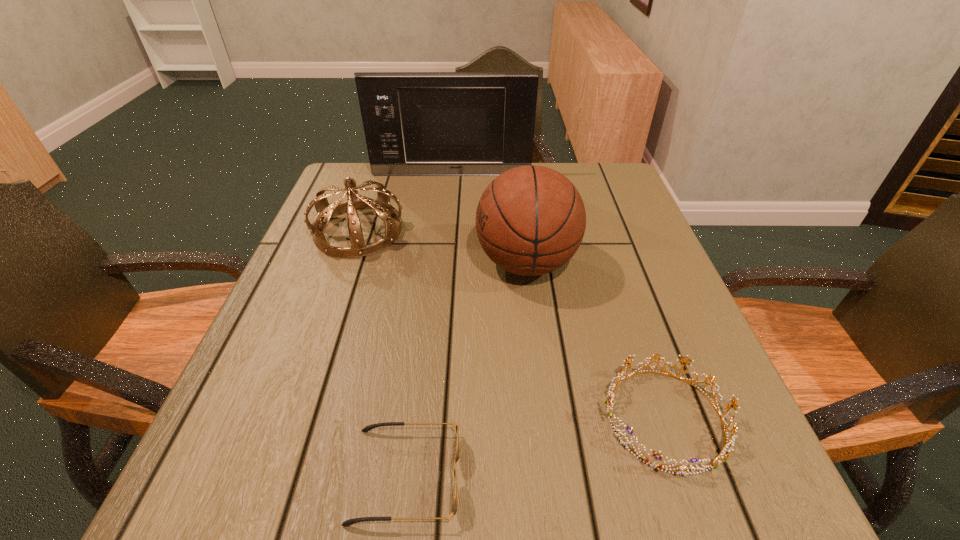
Where is `sunglasses located at the near edge`? The width and height of the screenshot is (960, 540). sunglasses located at the near edge is located at coordinates (349, 522).

Find the location of `microwave oven present at the left edge`. microwave oven present at the left edge is located at coordinates (416, 123).

Locate an element on the screen. The image size is (960, 540). tiara that is at the left edge is located at coordinates (381, 205).

Find the location of a particular element. This screenshot has height=540, width=960. object that is at the right edge is located at coordinates (722, 457).

Locate an element on the screen. This screenshot has height=540, width=960. microwave oven that is positioned at the far left corner is located at coordinates (416, 123).

This screenshot has width=960, height=540. I want to click on tiara that is at the far left corner, so click(x=381, y=205).

Locate an element on the screen. This screenshot has height=540, width=960. object that is positioned at the near right corner is located at coordinates (722, 457).

Find the location of `vacant region at the far edge`. vacant region at the far edge is located at coordinates (421, 199).

Find the location of a particular element. This screenshot has height=540, width=960. free space at the near edge is located at coordinates (343, 487).

At what (x,y) coordinates should I click in order to perform the action: click on vacant space at the left edge of the desktop. Please return your answer as a coordinate pair (x, y). Looking at the image, I should click on (293, 377).